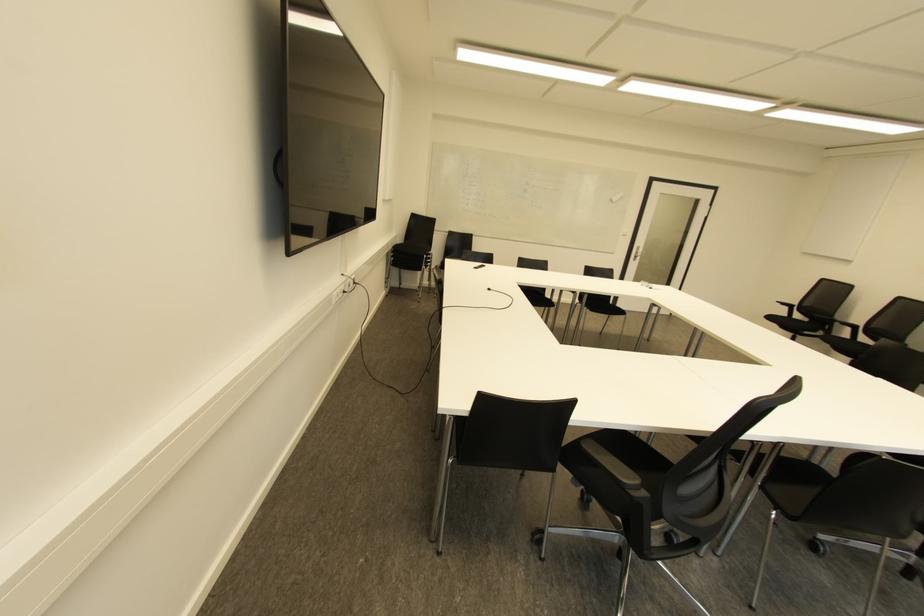
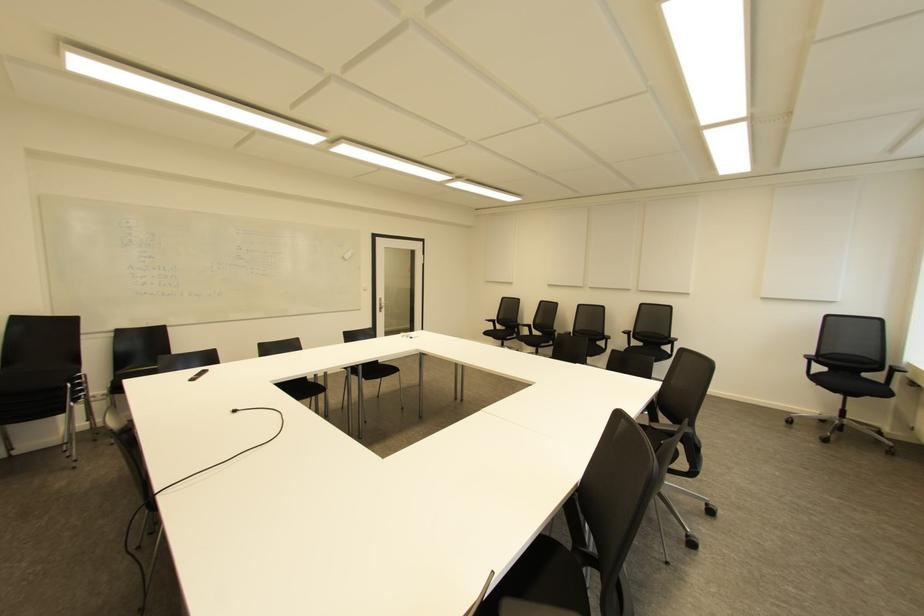
Question: The images are taken continuously from a first-person perspective. In which direction is your viewpoint rotating?

Choices:
 (A) Left
 (B) Right
 (C) Up
 (D) Down

Answer: (B)